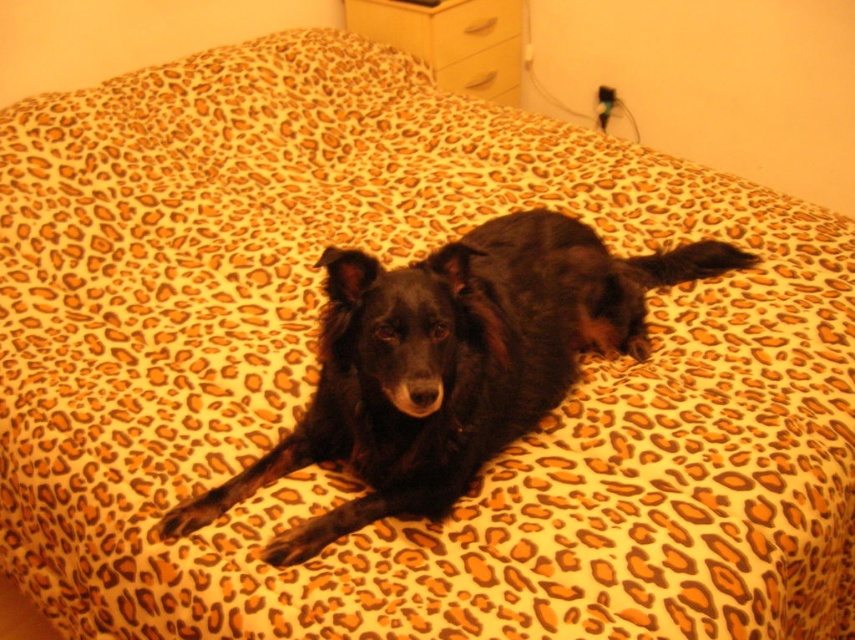
You are organizing a small toy collection and need to place a rectangular box that is 12 inches long. You see the matte white drawer at upper center and the matte yellow drawer at upper center. Which drawer has enough space to fit the box?

The matte white drawer at upper center has a greater width than the matte yellow drawer at upper center. Since the box is 12 inches long, the matte white drawer at upper center is more likely to have enough space to accommodate the box.

You are a delivery person who needs to place a small package on the matte yellow drawer at upper center. However, the black fur dog at center is blocking the drawer. Can you place the package there without moving the dog?

The black fur dog at center is located below the matte yellow drawer at upper center, so the drawer is above the dog. Therefore, you can place the package on the matte yellow drawer at upper center without moving the dog since the dog is below it.

You are a photographer trying to capture the black fur dog at center in the center of your photo. Based on the scene description, is the dog already positioned at the exact center of the image?

The 2D location of black fur dog at center is at point (451,362), which is close to the center but not exactly at the center point of the image. Therefore, the dog is not positioned exactly at the center of the image.